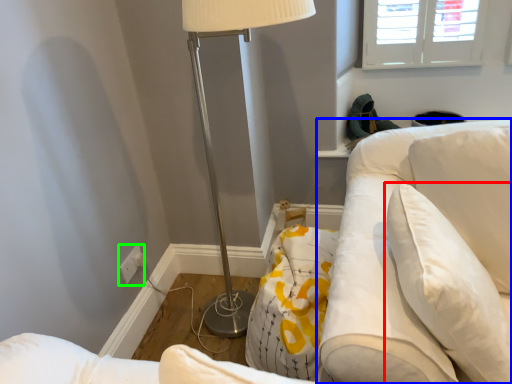
Question: Which object is positioned farthest from pillow (highlighted by a red box)? Select from swivel chair (highlighted by a blue box) and electric outlet (highlighted by a green box).

Choices:
 (A) swivel chair
 (B) electric outlet

Answer: (B)